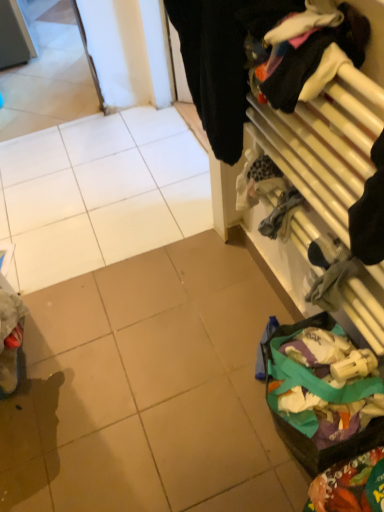
I want to click on vacant space underneath black fabric at upper right (from a real-world perspective), so pos(234,267).